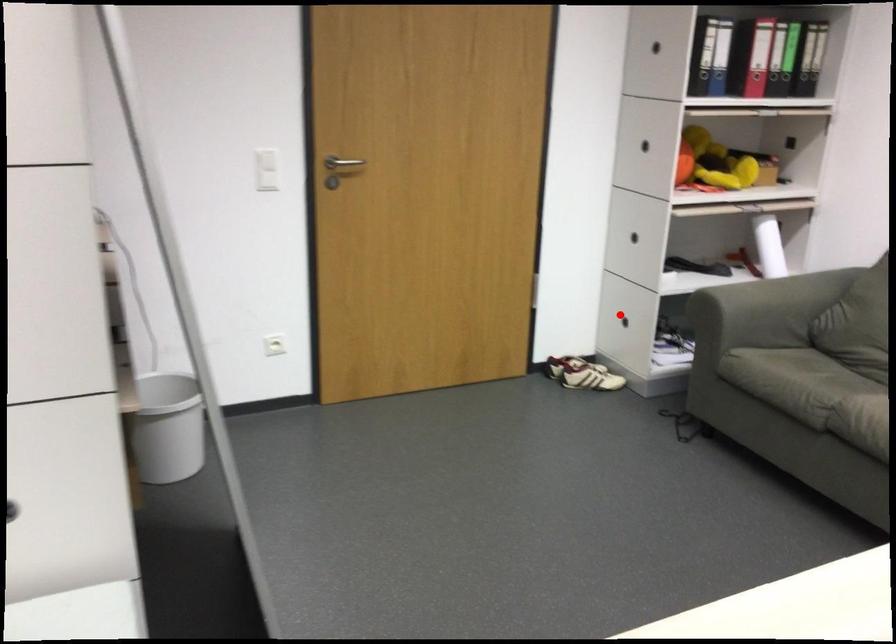
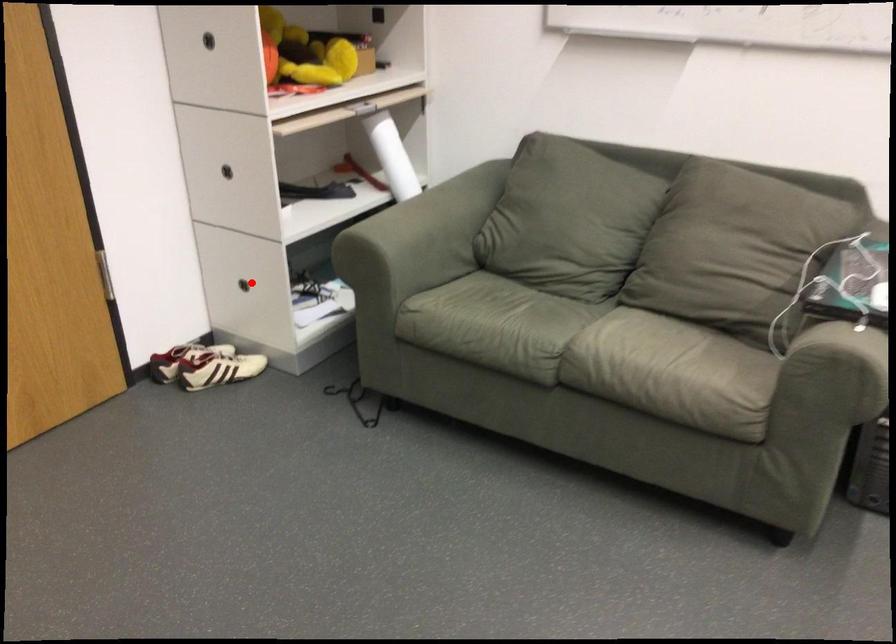
I am providing you with two images of the same scene from different viewpoints. A red point is marked on the first image and another point is marked on the second image. Do the highlighted points in image1 and image2 indicate the same real-world spot?

Yes